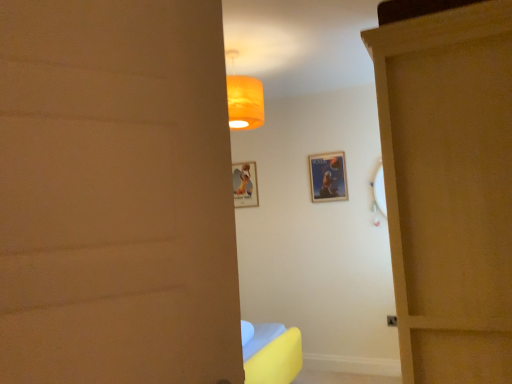
The height and width of the screenshot is (384, 512). What are the coordinates of `metallic silver poster at center, which appears as the 2th picture frame when viewed from the back` in the screenshot? It's located at (328, 177).

The width and height of the screenshot is (512, 384). Find the location of `matte paper picture frame at center, acting as the 1th picture frame starting from the back`. matte paper picture frame at center, acting as the 1th picture frame starting from the back is located at coordinates (245, 184).

I want to click on metallic silver poster at center, which appears as the 2th picture frame when viewed from the back, so click(x=328, y=177).

Does metallic silver poster at center, which is counted as the second picture frame, starting from the left, have a greater width compared to matte paper picture frame at center, which appears as the 2th picture frame when viewed from the front?

No, metallic silver poster at center, which is counted as the second picture frame, starting from the left, is not wider than matte paper picture frame at center, which appears as the 2th picture frame when viewed from the front.

Does metallic silver poster at center, which is counted as the second picture frame, starting from the left, have a lesser height compared to matte paper picture frame at center, which is counted as the first picture frame, starting from the left?

Correct, metallic silver poster at center, which is counted as the second picture frame, starting from the left, is not as tall as matte paper picture frame at center, which is counted as the first picture frame, starting from the left.

From a real-world perspective, who is located higher, metallic silver poster at center, positioned as the 1th picture frame in front-to-back order, or matte paper picture frame at center, which is counted as the second picture frame, starting from the right?

matte paper picture frame at center, which is counted as the second picture frame, starting from the right, is physically above.

Is matte paper picture frame at center, acting as the 1th picture frame starting from the back, next to wooden door at right and touching it?

matte paper picture frame at center, acting as the 1th picture frame starting from the back, is not next to wooden door at right, and they're not touching.

Which of these two, matte paper picture frame at center, acting as the 1th picture frame starting from the back, or wooden door at right, is smaller?

With smaller size is matte paper picture frame at center, acting as the 1th picture frame starting from the back.

Considering the sizes of objects matte paper picture frame at center, which is counted as the first picture frame, starting from the left, and wooden door at right in the image provided, who is shorter, matte paper picture frame at center, which is counted as the first picture frame, starting from the left, or wooden door at right?

matte paper picture frame at center, which is counted as the first picture frame, starting from the left.

Is matte paper picture frame at center, which is counted as the first picture frame, starting from the left, further to the viewer compared to wooden door at right?

Yes.

Looking at this image, from a real-world perspective, is wooden door at right positioned over metallic silver poster at center, marked as the first picture frame in a right-to-left arrangement, based on gravity?

No, from a real-world perspective, wooden door at right is not over metallic silver poster at center, marked as the first picture frame in a right-to-left arrangement

From the image's perspective, which one is positioned lower, wooden door at right or metallic silver poster at center, positioned as the 1th picture frame in front-to-back order?

From the image's view, wooden door at right is below.

How different are the orientations of wooden door at right and metallic silver poster at center, which is counted as the second picture frame, starting from the left, in degrees?

They differ by 90.4 degrees in their facing directions.

Is wooden door at right looking in the opposite direction of metallic silver poster at center, which is counted as the second picture frame, starting from the left?

No, metallic silver poster at center, which is counted as the second picture frame, starting from the left, is not at the back of wooden door at right.

Which is behind, point (340, 179) or point (436, 47)?

Point (340, 179)

From the image's perspective, starting from the wooden door at right, which picture frame is the 2nd one above? Please provide its 2D coordinates.

[(328, 177)]

How many degrees apart are the facing directions of metallic silver poster at center, positioned as the 1th picture frame in front-to-back order, and wooden door at right?

They differ by 90.4 degrees in their facing directions.

Which is correct: metallic silver poster at center, which is counted as the second picture frame, starting from the left, is inside wooden door at right, or outside of it?

The correct answer is: outside.

From the image's perspective, is wooden door at right positioned above or below matte paper picture frame at center, which is counted as the second picture frame, starting from the right?

wooden door at right is below matte paper picture frame at center, which is counted as the second picture frame, starting from the right.

How much distance is there between wooden door at right and matte paper picture frame at center, which is counted as the first picture frame, starting from the left?

wooden door at right is 2.59 meters from matte paper picture frame at center, which is counted as the first picture frame, starting from the left.

Is matte paper picture frame at center, which is counted as the first picture frame, starting from the left, at the back of wooden door at right?

No, wooden door at right is not facing away from matte paper picture frame at center, which is counted as the first picture frame, starting from the left.

Which object is positioned more to the left, matte paper picture frame at center, which is counted as the second picture frame, starting from the right, or metallic silver poster at center, marked as the first picture frame in a right-to-left arrangement?

matte paper picture frame at center, which is counted as the second picture frame, starting from the right, is more to the left.

From the image's perspective, who appears lower, matte paper picture frame at center, which is counted as the first picture frame, starting from the left, or metallic silver poster at center, which appears as the 2th picture frame when viewed from the back?

matte paper picture frame at center, which is counted as the first picture frame, starting from the left.

Is matte paper picture frame at center, which is counted as the second picture frame, starting from the right, not inside metallic silver poster at center, which is counted as the second picture frame, starting from the left?

Indeed, matte paper picture frame at center, which is counted as the second picture frame, starting from the right, is completely outside metallic silver poster at center, which is counted as the second picture frame, starting from the left.

Between point (240, 199) and point (345, 199), which one is positioned in front?

The point (345, 199) is closer to the camera.

Find the location of `picture frame below the matte paper picture frame at center, which is counted as the first picture frame, starting from the left (from a real-world perspective)`. picture frame below the matte paper picture frame at center, which is counted as the first picture frame, starting from the left (from a real-world perspective) is located at coordinates (328, 177).

At what (x,y) coordinates should I click in order to perform the action: click on the 2nd picture frame behind the wooden door at right, counting from the anchor's position. Please return your answer as a coordinate pair (x, y). This screenshot has height=384, width=512. Looking at the image, I should click on (245, 184).

When comparing their distances from metallic silver poster at center, positioned as the 1th picture frame in front-to-back order, does wooden door at right or matte paper picture frame at center, which appears as the 2th picture frame when viewed from the front, seem further?

wooden door at right is further to metallic silver poster at center, positioned as the 1th picture frame in front-to-back order.

Based on their spatial positions, is metallic silver poster at center, marked as the first picture frame in a right-to-left arrangement, or wooden door at right further from matte paper picture frame at center, which is counted as the first picture frame, starting from the left?

wooden door at right is further to matte paper picture frame at center, which is counted as the first picture frame, starting from the left.

Estimate the real-world distances between objects in this image. Which object is closer to wooden door at right, matte paper picture frame at center, acting as the 1th picture frame starting from the back, or metallic silver poster at center, marked as the first picture frame in a right-to-left arrangement?

metallic silver poster at center, marked as the first picture frame in a right-to-left arrangement.

Looking at the image, which one is located further to wooden door at right, metallic silver poster at center, which is counted as the second picture frame, starting from the left, or matte paper picture frame at center, which is counted as the second picture frame, starting from the right?

matte paper picture frame at center, which is counted as the second picture frame, starting from the right, is positioned further to the anchor wooden door at right.

Looking at this image, considering their positions, is matte paper picture frame at center, which appears as the 2th picture frame when viewed from the front, positioned closer to metallic silver poster at center, marked as the first picture frame in a right-to-left arrangement, than wooden door at right?

matte paper picture frame at center, which appears as the 2th picture frame when viewed from the front, is positioned closer to the anchor metallic silver poster at center, marked as the first picture frame in a right-to-left arrangement.

Based on their spatial positions, is wooden door at right or metallic silver poster at center, which appears as the 2th picture frame when viewed from the back, further from matte paper picture frame at center, which is counted as the second picture frame, starting from the right?

wooden door at right is further to matte paper picture frame at center, which is counted as the second picture frame, starting from the right.

I want to click on picture frame between wooden door at right and matte paper picture frame at center, acting as the 1th picture frame starting from the back, from front to back, so pyautogui.click(x=328, y=177).